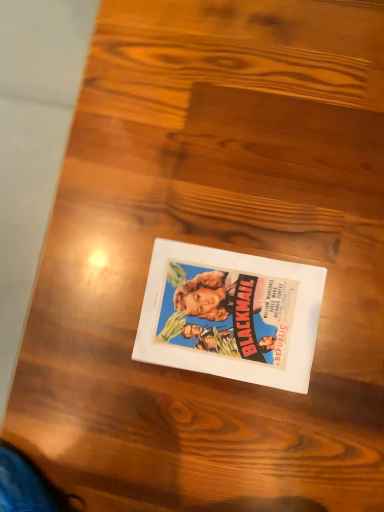
You are a GUI agent. You are given a task and a screenshot of the screen. Output one action in this format:
    pyautogui.click(x=<x>, y=<y>)
    Task: Click on the unoccupied space behind matte paper book at center
    Image resolution: width=384 pixels, height=512 pixels.
    Given the screenshot: What is the action you would take?
    pyautogui.click(x=145, y=208)